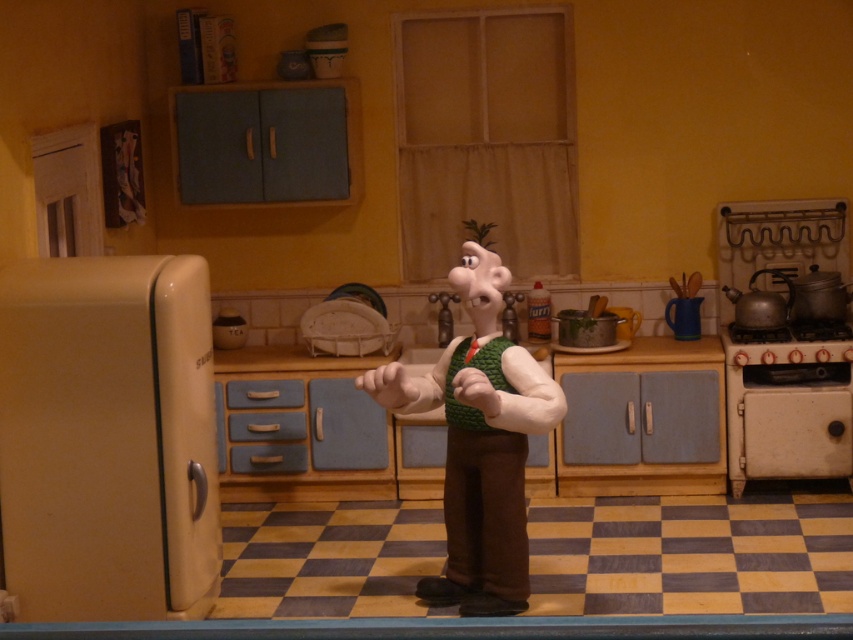
You are designing a kitchen layout and need to place the beige matte refrigerator at left and the green knitted vest at center. Given that the refrigerator is thinner than the vest, which object requires more horizontal space in the kitchen?

The green knitted vest at center requires more horizontal space because it is thicker than the beige matte refrigerator at left.

You are designing a layout for a miniature kitchen set and need to place the beige matte refrigerator at left and the green knitted vest at center. Given their sizes, which object should be placed closer to the front to maintain a balanced appearance?

The beige matte refrigerator at left should be placed closer to the front since it has a smaller size compared to the green knitted vest at center, ensuring visual balance by positioning smaller items forward.